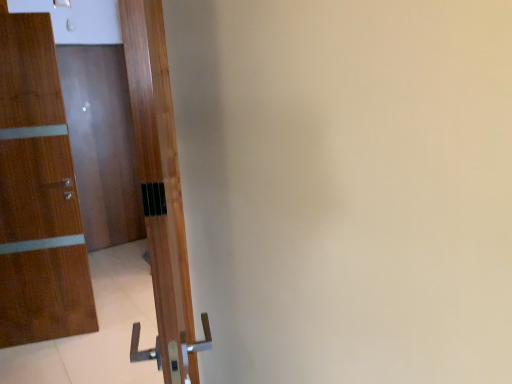
The image size is (512, 384). I want to click on wooden door at left, the second door positioned from the right, so click(x=38, y=194).

Measure the distance between point (84,159) and camera.

A distance of 4.23 meters exists between point (84,159) and camera.

Locate an element on the screen. The image size is (512, 384). wooden door at left, positioned as the third door in back-to-front order is located at coordinates (160, 193).

Is wooden door at left, acting as the second door starting from the front, facing away from glossy wood door at left, acting as the 1th door starting from the back?

Correct, wooden door at left, acting as the second door starting from the front, is looking away from glossy wood door at left, acting as the 1th door starting from the back.

Can you confirm if wooden door at left, acting as the second door starting from the front, is shorter than glossy wood door at left, which is the 1th door in left-to-right order?

Indeed, wooden door at left, acting as the second door starting from the front, has a lesser height compared to glossy wood door at left, which is the 1th door in left-to-right order.

Considering the relative positions of wooden door at left, acting as the second door starting from the front, and glossy wood door at left, which is counted as the 3th door, starting from the front, in the image provided, is wooden door at left, acting as the second door starting from the front, to the left or to the right of glossy wood door at left, which is counted as the 3th door, starting from the front,?

From the image, it's evident that wooden door at left, acting as the second door starting from the front, is to the right of glossy wood door at left, which is counted as the 3th door, starting from the front.

Looking at this image, is glossy wood door at left, which is counted as the 3th door, starting from the front, inside wooden door at left, the second door from the back?

Definitely not — glossy wood door at left, which is counted as the 3th door, starting from the front, is not inside wooden door at left, the second door from the back.

Is glossy wood door at left, which is the 1th door in left-to-right order, with wooden door at left, the second door from the back?

glossy wood door at left, which is the 1th door in left-to-right order, and wooden door at left, the second door from the back, are not in contact.

From a real-world perspective, relative to wooden door at left, acting as the second door starting from the front, is glossy wood door at left, which is counted as the 3th door, starting from the front, vertically above or below?

Clearly, from a real-world perspective, glossy wood door at left, which is counted as the 3th door, starting from the front, is above wooden door at left, acting as the second door starting from the front.

This screenshot has width=512, height=384. In order to click on door on the left of the wooden door at left, the second door viewed from the left in this screenshot , I will do `click(102, 143)`.

Do you think wooden door at left, which ranks as the 1th door in right-to-left order, is within wooden door at left, acting as the second door starting from the front, or outside of it?

wooden door at left, which ranks as the 1th door in right-to-left order, is not enclosed by wooden door at left, acting as the second door starting from the front.

Is wooden door at left, acting as the third door starting from the left, turned away from wooden door at left, the second door from the back?

No, wooden door at left, acting as the third door starting from the left,'s orientation is not away from wooden door at left, the second door from the back.

Between wooden door at left, which ranks as the 1th door in right-to-left order, and wooden door at left, the second door from the back, which one has less height?

Standing shorter between the two is wooden door at left, which ranks as the 1th door in right-to-left order.

Is wooden door at left, placed as the 1th door when sorted from front to back, wider than glossy wood door at left, the 3th door when ordered from right to left?

Indeed, wooden door at left, placed as the 1th door when sorted from front to back, has a greater width compared to glossy wood door at left, the 3th door when ordered from right to left.

Which is in front, point (166, 320) or point (123, 184)?

Point (166, 320)

From their relative heights in the image, would you say wooden door at left, placed as the 1th door when sorted from front to back, is taller or shorter than glossy wood door at left, which is the 1th door in left-to-right order?

In the image, wooden door at left, placed as the 1th door when sorted from front to back, appears to be shorter than glossy wood door at left, which is the 1th door in left-to-right order.

In the scene shown: Is wooden door at left, positioned as the third door in back-to-front order, surrounding glossy wood door at left, which is the 1th door in left-to-right order?

Actually, glossy wood door at left, which is the 1th door in left-to-right order, is outside wooden door at left, positioned as the third door in back-to-front order.

Between wooden door at left, acting as the second door starting from the front, and wooden door at left, positioned as the third door in back-to-front order, which one has larger size?

wooden door at left, positioned as the third door in back-to-front order, is bigger.

Image resolution: width=512 pixels, height=384 pixels. I want to click on door that is the 1st object located above the wooden door at left, which ranks as the 1th door in right-to-left order (from the image's perspective), so click(38, 194).

Is wooden door at left, the second door positioned from the right, completely or partially outside of wooden door at left, placed as the 1th door when sorted from front to back?

wooden door at left, the second door positioned from the right, is positioned outside wooden door at left, placed as the 1th door when sorted from front to back.

Does glossy wood door at left, which is the 1th door in left-to-right order, have a smaller size compared to wooden door at left, acting as the third door starting from the left?

Yes, glossy wood door at left, which is the 1th door in left-to-right order, is smaller than wooden door at left, acting as the third door starting from the left.

Which of these two, glossy wood door at left, which is counted as the 3th door, starting from the front, or wooden door at left, which ranks as the 1th door in right-to-left order, is wider?

wooden door at left, which ranks as the 1th door in right-to-left order.

Who is taller, glossy wood door at left, which is counted as the 3th door, starting from the front, or wooden door at left, acting as the third door starting from the left?

Standing taller between the two is glossy wood door at left, which is counted as the 3th door, starting from the front.

At what (x,y) coordinates should I click in order to perform the action: click on door that is above the wooden door at left, the second door viewed from the left (from the image's perspective). Please return your answer as a coordinate pair (x, y). This screenshot has height=384, width=512. Looking at the image, I should click on (102, 143).

Find the location of `door that is the 1st object located below the glossy wood door at left, acting as the 1th door starting from the back (from the image's perspective)`. door that is the 1st object located below the glossy wood door at left, acting as the 1th door starting from the back (from the image's perspective) is located at coordinates (38, 194).

In the scene shown: Looking at the image, which one is located closer to wooden door at left, which ranks as the 1th door in right-to-left order, glossy wood door at left, the 3th door when ordered from right to left, or wooden door at left, the second door positioned from the right?

The object closer to wooden door at left, which ranks as the 1th door in right-to-left order, is wooden door at left, the second door positioned from the right.

From the picture: When comparing their distances from glossy wood door at left, the 3th door when ordered from right to left, does wooden door at left, which ranks as the 1th door in right-to-left order, or wooden door at left, the second door viewed from the left, seem further?

wooden door at left, which ranks as the 1th door in right-to-left order, is positioned further to the anchor glossy wood door at left, the 3th door when ordered from right to left.

Which object lies nearer to the anchor point wooden door at left, the second door viewed from the left, glossy wood door at left, the 3th door when ordered from right to left, or wooden door at left, acting as the third door starting from the left?

wooden door at left, acting as the third door starting from the left, lies closer to wooden door at left, the second door viewed from the left, than the other object.

Looking at the image, which one is located closer to wooden door at left, acting as the third door starting from the left, wooden door at left, the second door from the back, or glossy wood door at left, the 3th door when ordered from right to left?

wooden door at left, the second door from the back, is closer to wooden door at left, acting as the third door starting from the left.

When comparing their distances from wooden door at left, the second door viewed from the left, does wooden door at left, positioned as the third door in back-to-front order, or glossy wood door at left, which is counted as the 3th door, starting from the front, seem closer?

wooden door at left, positioned as the third door in back-to-front order, is positioned closer to the anchor wooden door at left, the second door viewed from the left.

Estimate the real-world distances between objects in this image. Which object is closer to glossy wood door at left, the 3th door when ordered from right to left, wooden door at left, the second door viewed from the left, or wooden door at left, which ranks as the 1th door in right-to-left order?

Based on the image, wooden door at left, the second door viewed from the left, appears to be nearer to glossy wood door at left, the 3th door when ordered from right to left.

Locate an element on the screen. door located between wooden door at left, which ranks as the 1th door in right-to-left order, and glossy wood door at left, which is the 1th door in left-to-right order, in the depth direction is located at coordinates (38, 194).